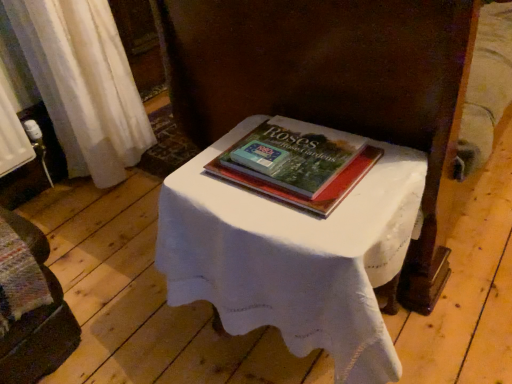
Locate an element on the screen. vacant space behind wooden bench at lower left is located at coordinates (89, 233).